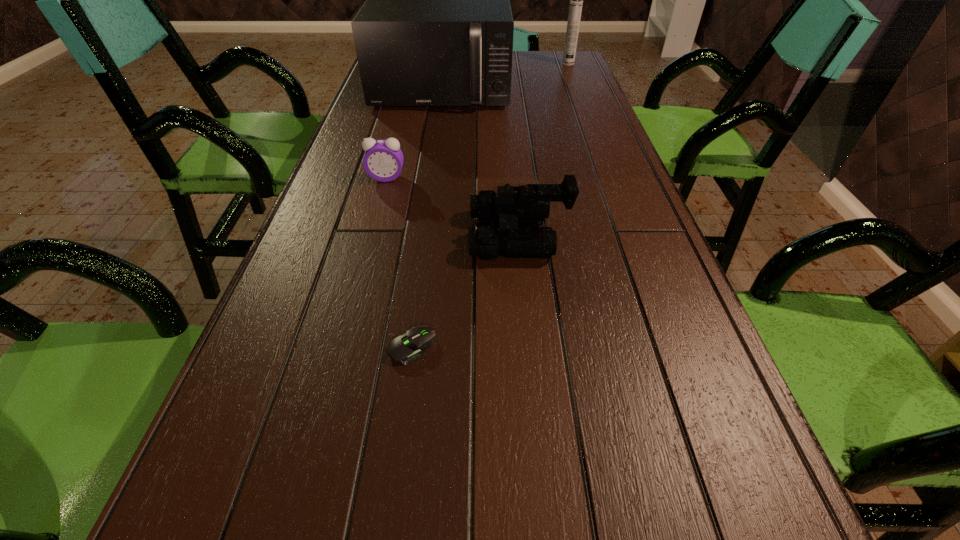
You are a GUI agent. You are given a task and a screenshot of the screen. Output one action in this format:
    pyautogui.click(x=<x>, y=<y>)
    Task: Click on the object that is positioned at the far left corner
    This screenshot has height=540, width=960.
    Given the screenshot: What is the action you would take?
    pyautogui.click(x=436, y=29)

Find the location of a particular element. Image resolution: width=960 pixels, height=540 pixels. object situated at the far right corner is located at coordinates (576, 0).

The image size is (960, 540). In the image, there is a desktop. Find the location of `vacant space at the far edge`. vacant space at the far edge is located at coordinates (524, 55).

Where is `vacant region at the left edge`? The height and width of the screenshot is (540, 960). vacant region at the left edge is located at coordinates (262, 480).

I want to click on free space at the right edge of the desktop, so click(x=665, y=461).

I want to click on vacant space at the far right corner of the desktop, so click(547, 73).

The height and width of the screenshot is (540, 960). What are the coordinates of `free space between the microwave oven and the binoculars` in the screenshot? It's located at (481, 161).

What are the coordinates of `vacant space that's between the shortest object and the microwave oven` in the screenshot? It's located at (427, 218).

Locate an element on the screen. free space between the alarm clock and the nearest object is located at coordinates point(399,262).

Where is `vacant region between the nearest object and the third shortest object`? The image size is (960, 540). vacant region between the nearest object and the third shortest object is located at coordinates (466, 292).